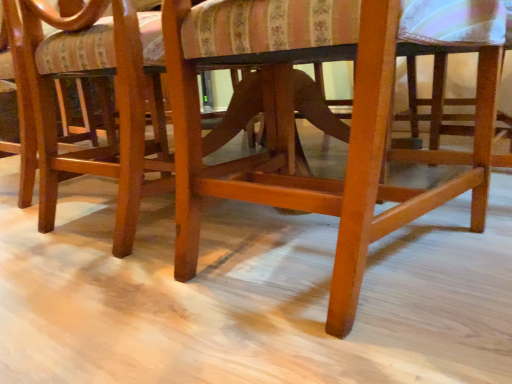
Question: From a real-world perspective, is wooden chair at center, positioned as the second chair in left-to-right order, over glossy wood chair at center, positioned as the second chair in right-to-left order?

Choices:
 (A) yes
 (B) no

Answer: (B)

Question: Does wooden chair at center, which is the first chair from right to left, turn towards glossy wood chair at center, the 1th chair from the left?

Choices:
 (A) no
 (B) yes

Answer: (A)

Question: Can you confirm if wooden chair at center, which is the first chair from right to left, is wider than glossy wood chair at center, the 1th chair from the left?

Choices:
 (A) yes
 (B) no

Answer: (A)

Question: Considering the relative sizes of wooden chair at center, positioned as the second chair in left-to-right order, and glossy wood chair at center, the 1th chair from the left, in the image provided, is wooden chair at center, positioned as the second chair in left-to-right order, shorter than glossy wood chair at center, the 1th chair from the left,?

Choices:
 (A) yes
 (B) no

Answer: (A)

Question: Can we say wooden chair at center, positioned as the second chair in left-to-right order, lies outside glossy wood chair at center, positioned as the second chair in right-to-left order?

Choices:
 (A) no
 (B) yes

Answer: (B)

Question: Considering the relative sizes of wooden chair at center, positioned as the second chair in left-to-right order, and glossy wood chair at center, the 1th chair from the left, in the image provided, is wooden chair at center, positioned as the second chair in left-to-right order, thinner than glossy wood chair at center, the 1th chair from the left,?

Choices:
 (A) yes
 (B) no

Answer: (B)

Question: From a real-world perspective, does glossy wood chair at center, the 1th chair from the left, stand above wooden chair at center, positioned as the second chair in left-to-right order?

Choices:
 (A) no
 (B) yes

Answer: (B)

Question: Is glossy wood chair at center, the 1th chair from the left, bigger than wooden chair at center, which is the first chair from right to left?

Choices:
 (A) yes
 (B) no

Answer: (A)

Question: From the image's perspective, is glossy wood chair at center, the 1th chair from the left, located beneath wooden chair at center, positioned as the second chair in left-to-right order?

Choices:
 (A) no
 (B) yes

Answer: (A)

Question: Can you confirm if glossy wood chair at center, the 1th chair from the left, is shorter than wooden chair at center, positioned as the second chair in left-to-right order?

Choices:
 (A) no
 (B) yes

Answer: (A)

Question: Could you tell me if glossy wood chair at center, the 1th chair from the left, is turned towards wooden chair at center, which is the first chair from right to left?

Choices:
 (A) no
 (B) yes

Answer: (A)

Question: Can you confirm if glossy wood chair at center, the 1th chair from the left, is taller than wooden chair at center, which is the first chair from right to left?

Choices:
 (A) no
 (B) yes

Answer: (B)

Question: From the image's perspective, relative to wooden chair at center, which is the first chair from right to left, is glossy wood chair at center, the 1th chair from the left, above or below?

Choices:
 (A) below
 (B) above

Answer: (B)